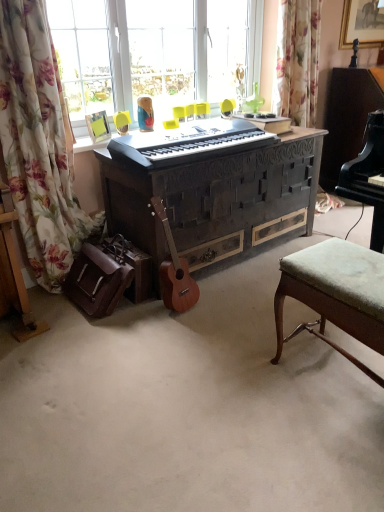
Find the location of `free spot above green fabric stool at lower right (from a real-world perspective)`. free spot above green fabric stool at lower right (from a real-world perspective) is located at coordinates (346, 265).